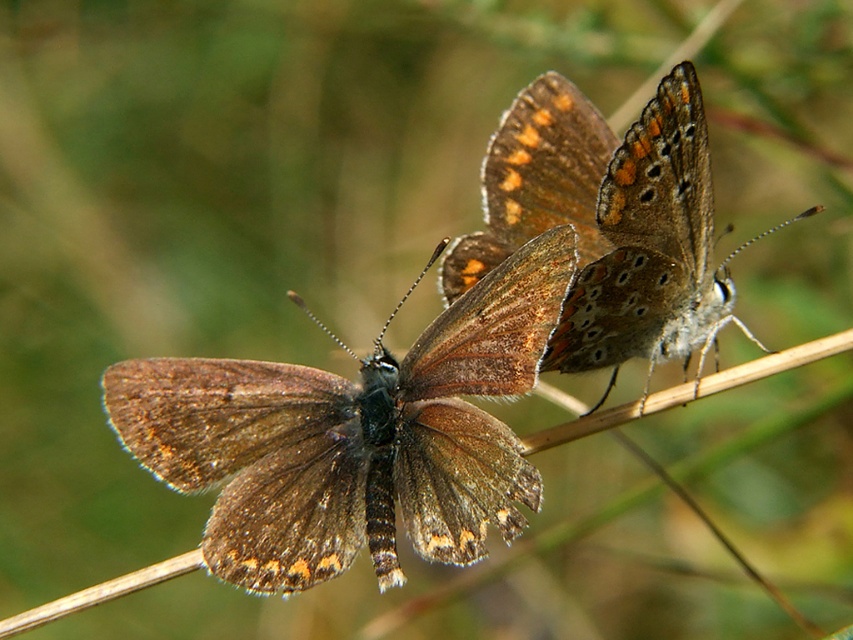
Question: Which point is farther to the camera?

Choices:
 (A) brown textured wings at center
 (B) brown fuzzy butterfly at center

Answer: (B)

Question: Observing the image, what is the correct spatial positioning of brown fuzzy butterfly at center in reference to brown textured wings at center?

Choices:
 (A) left
 (B) right

Answer: (A)

Question: From the image, what is the correct spatial relationship of brown fuzzy butterfly at center in relation to brown textured wings at center?

Choices:
 (A) above
 (B) below

Answer: (B)

Question: Which point is farther to the camera?

Choices:
 (A) (416, 538)
 (B) (611, 230)

Answer: (B)

Question: Among these points, which one is nearest to the camera?

Choices:
 (A) (705, 273)
 (B) (465, 433)

Answer: (B)

Question: In this image, where is brown fuzzy butterfly at center located relative to brown textured wings at center?

Choices:
 (A) left
 (B) right

Answer: (A)